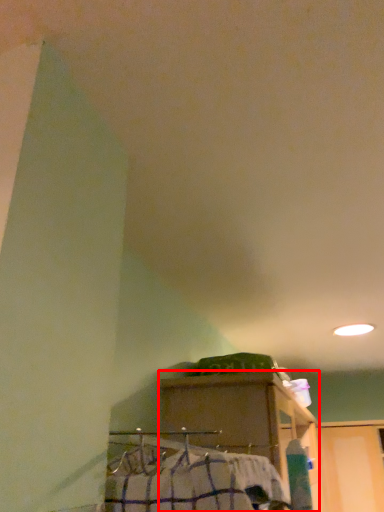
Question: From the image's perspective, considering the relative positions of furniture (annotated by the red box) and job in the image provided, where is furniture (annotated by the red box) located with respect to the staircase?

Choices:
 (A) below
 (B) above

Answer: (A)